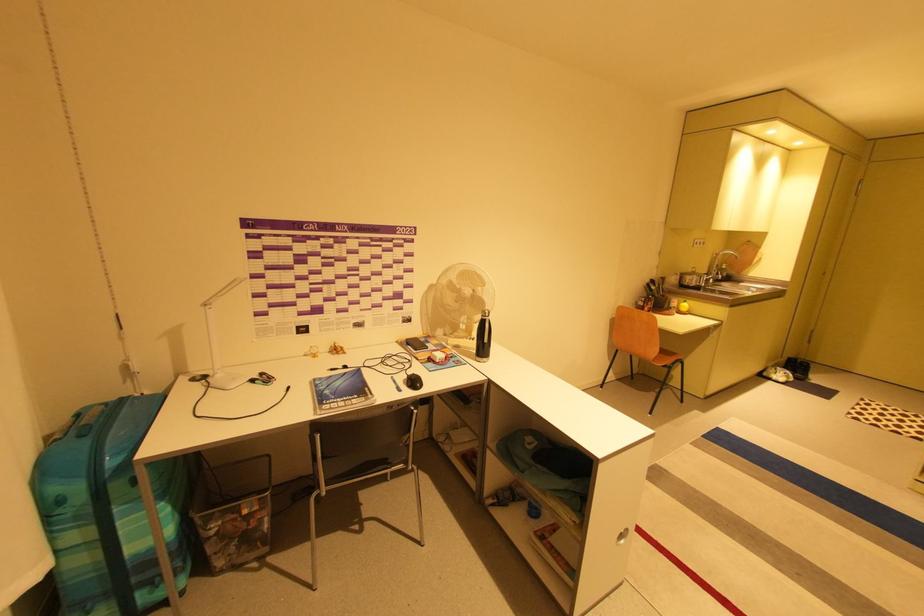
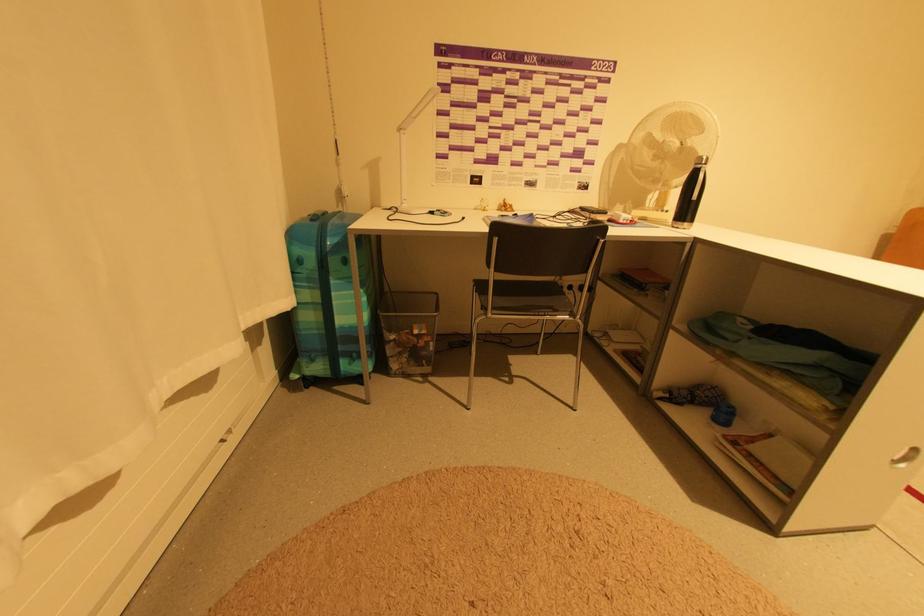
Question: The first image is from the beginning of the video and the second image is from the end. How did the camera likely rotate when shooting the video?

Choices:
 (A) Left
 (B) Right
 (C) Up
 (D) Down

Answer: (A)